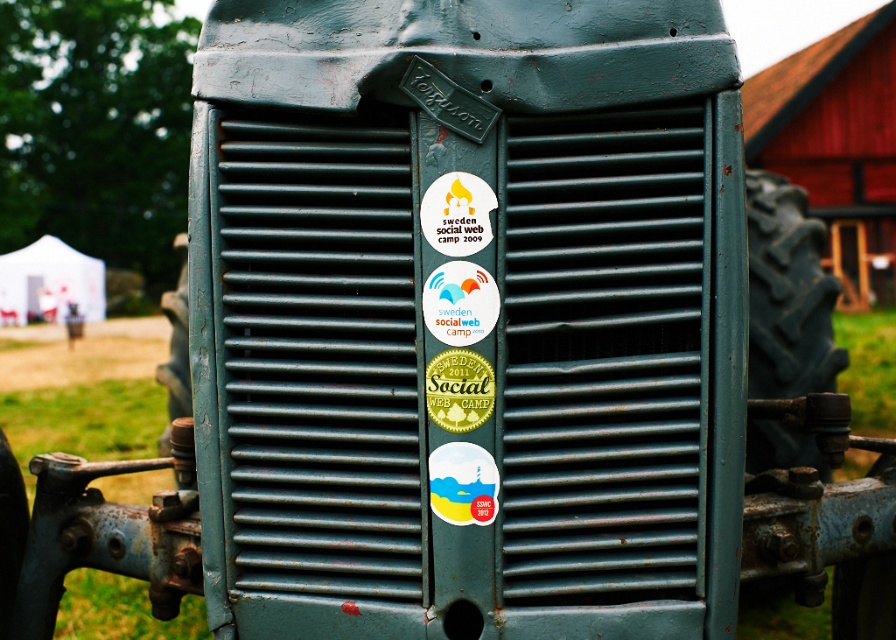
Question: Based on their relative distances, which object is nearer to the white glossy sticker at center?

Choices:
 (A) white paper sticker at center
 (B) matte plastic sticker at center
 (C) green matte sticker at center

Answer: (C)

Question: Can you confirm if white glossy sticker at center is positioned to the left of matte plastic sticker at center?

Choices:
 (A) no
 (B) yes

Answer: (B)

Question: Is white glossy sticker at center below matte plastic sticker at center?

Choices:
 (A) no
 (B) yes

Answer: (A)

Question: Which point is farther to the camera?

Choices:
 (A) (470, 228)
 (B) (480, 484)
 (C) (438, 280)
 (D) (461, 416)

Answer: (B)

Question: Is white paper sticker at center above green matte sticker at center?

Choices:
 (A) no
 (B) yes

Answer: (B)

Question: Which point is closer to the camera?

Choices:
 (A) (438, 500)
 (B) (449, 289)
 (C) (463, 208)

Answer: (C)